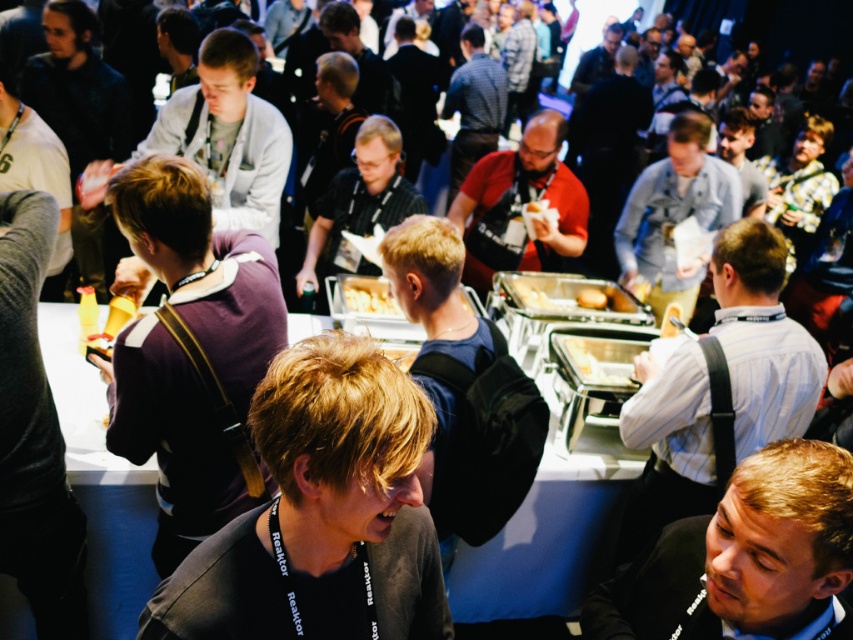
You are at a networking event and want to take a photo of the light brown leather jacket at center. What are the coordinates where you should aim your camera?

The coordinates for the light brown leather jacket at center are at point (674,214).

You are a photographer at the event and want to capture both the light brown leather jacket at center and the blue shirt at center in a single photo. Which clothing item should you focus on first to ensure both are in frame?

The light brown leather jacket at center has a lesser height compared to blue shirt at center, so you should focus on the blue shirt at center first to ensure both are in frame.

You are standing at the entrance of the event and want to locate the light brown leather jacket at center. According to the coordinates provided, where would you look to find it?

The light brown leather jacket at center is located at coordinates point (x=674, y=214), which is in the lower central area of the image.